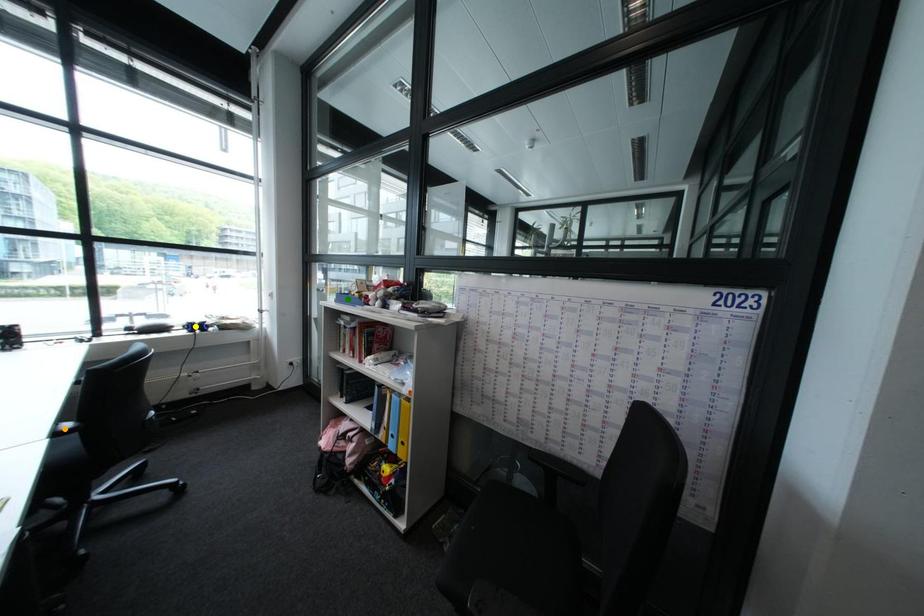
Order these from nearest to farthest:
orange point | yellow point | green point

orange point, green point, yellow point